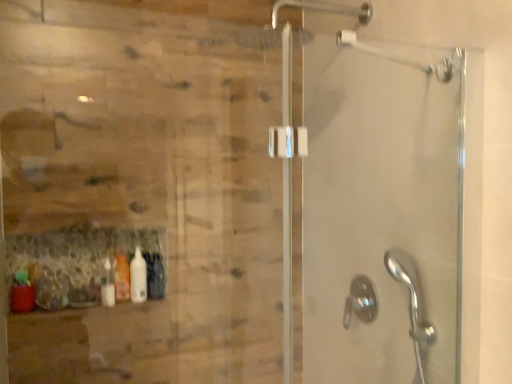
Where is `satin nickel showerhead at lower right`? satin nickel showerhead at lower right is located at coordinates (360, 301).

What do you see at coordinates (360, 301) in the screenshot? I see `satin nickel showerhead at lower right` at bounding box center [360, 301].

This screenshot has height=384, width=512. What do you see at coordinates (138, 277) in the screenshot?
I see `white glossy bottle at lower left, the 2th bottle positioned from the front` at bounding box center [138, 277].

Where is `translucent plastic bottle at lower left, which appears as the first bottle when viewed from the back`? The width and height of the screenshot is (512, 384). translucent plastic bottle at lower left, which appears as the first bottle when viewed from the back is located at coordinates (122, 278).

Looking at this image, between translucent plastic bottle at lower left, the third bottle in the front-to-back sequence, and satin nickel showerhead at lower right, which one has larger size?

With larger size is satin nickel showerhead at lower right.

Which object is wider, translucent plastic bottle at lower left, the third bottle in the front-to-back sequence, or satin nickel showerhead at lower right?

satin nickel showerhead at lower right.

From a real-world perspective, which is physically above, translucent plastic bottle at lower left, the third bottle in the front-to-back sequence, or satin nickel showerhead at lower right?

translucent plastic bottle at lower left, the third bottle in the front-to-back sequence.

Is satin nickel showerhead at lower right not near white glossy bottle at lower left, the 2th bottle positioned from the front?

No.

Is satin nickel showerhead at lower right positioned behind white glossy bottle at lower left, the 2th bottle positioned from the front?

No, it is in front of white glossy bottle at lower left, the 2th bottle positioned from the front.

Where is `the 1st bottle counting from the left side of the satin nickel showerhead at lower right`? the 1st bottle counting from the left side of the satin nickel showerhead at lower right is located at coordinates (138, 277).

From a real-world perspective, does satin nickel showerhead at lower right sit lower than white glossy bottle at lower left, the 2th bottle positioned from the front?

Yes, from a real-world perspective, satin nickel showerhead at lower right is under white glossy bottle at lower left, the 2th bottle positioned from the front.

Is white glossy bottle at lower left, the 2th bottle positioned from the front, oriented away from translucent plastic bottle at lower left, the third bottle in the front-to-back sequence?

No, white glossy bottle at lower left, the 2th bottle positioned from the front, is not facing the opposite direction of translucent plastic bottle at lower left, the third bottle in the front-to-back sequence.

Is the position of white glossy bottle at lower left, the 2th bottle positioned from the front, less distant than that of translucent plastic bottle at lower left, which ranks as the 2th bottle in right-to-left order?

That is True.

Considering the relative sizes of white glossy bottle at lower left, the second bottle positioned from the back, and translucent plastic bottle at lower left, the second bottle when ordered from left to right, in the image provided, is white glossy bottle at lower left, the second bottle positioned from the back, thinner than translucent plastic bottle at lower left, the second bottle when ordered from left to right,?

Incorrect, the width of white glossy bottle at lower left, the second bottle positioned from the back, is not less than that of translucent plastic bottle at lower left, the second bottle when ordered from left to right.

Starting from the translucent plastic bottle at lower left, which appears as the first bottle when viewed from the back, which bottle is the 1st one in front? Please provide its 2D coordinates.

[(138, 277)]

Is matte red bottle at lower left, the third bottle viewed from the right, further to camera compared to satin nickel showerhead at lower right?

Yes, matte red bottle at lower left, the third bottle viewed from the right, is behind satin nickel showerhead at lower right.

In the scene shown: Is satin nickel showerhead at lower right at the back of matte red bottle at lower left, the first bottle in the left-to-right sequence?

That's not correct — matte red bottle at lower left, the first bottle in the left-to-right sequence, is not looking away from satin nickel showerhead at lower right.

Locate an element on the screen. This screenshot has height=384, width=512. bottle that is the 1st object above the satin nickel showerhead at lower right (from a real-world perspective) is located at coordinates (22, 293).

From the image's perspective, is matte red bottle at lower left, the first bottle in the left-to-right sequence, above or below satin nickel showerhead at lower right?

matte red bottle at lower left, the first bottle in the left-to-right sequence, is above satin nickel showerhead at lower right.

From the picture: Does satin nickel showerhead at lower right have a larger size compared to translucent plastic bottle at lower left, the second bottle when ordered from left to right?

Correct, satin nickel showerhead at lower right is larger in size than translucent plastic bottle at lower left, the second bottle when ordered from left to right.

Is satin nickel showerhead at lower right not close to translucent plastic bottle at lower left, which ranks as the 2th bottle in right-to-left order?

No, satin nickel showerhead at lower right is not far from translucent plastic bottle at lower left, which ranks as the 2th bottle in right-to-left order.

Is translucent plastic bottle at lower left, the third bottle in the front-to-back sequence, at the back of satin nickel showerhead at lower right?

No, satin nickel showerhead at lower right's orientation is not away from translucent plastic bottle at lower left, the third bottle in the front-to-back sequence.

Between satin nickel showerhead at lower right and translucent plastic bottle at lower left, the third bottle in the front-to-back sequence, which one has less height?

Standing shorter between the two is satin nickel showerhead at lower right.

You are a GUI agent. You are given a task and a screenshot of the screen. Output one action in this format:
    pyautogui.click(x=<x>, y=<y>)
    Task: Click on the bottle above the translucent plastic bottle at lower left, which ranks as the 2th bottle in right-to-left order (from a real-world perspective)
    The image size is (512, 384).
    Given the screenshot: What is the action you would take?
    pyautogui.click(x=138, y=277)

From their relative heights in the image, would you say translucent plastic bottle at lower left, which ranks as the 2th bottle in right-to-left order, is taller or shorter than white glossy bottle at lower left, the 2th bottle positioned from the front?

In the image, translucent plastic bottle at lower left, which ranks as the 2th bottle in right-to-left order, appears to be shorter than white glossy bottle at lower left, the 2th bottle positioned from the front.

Is translucent plastic bottle at lower left, which ranks as the 2th bottle in right-to-left order, bigger than white glossy bottle at lower left, the 2th bottle positioned from the front?

Incorrect, translucent plastic bottle at lower left, which ranks as the 2th bottle in right-to-left order, is not larger than white glossy bottle at lower left, the 2th bottle positioned from the front.

From a real-world perspective, which object stands above the other?

In real-world perspective, translucent plastic bottle at lower left, which ranks as the 2th bottle in right-to-left order, is above.

Considering the sizes of objects matte red bottle at lower left, the first bottle in the left-to-right sequence, and translucent plastic bottle at lower left, the third bottle in the front-to-back sequence, in the image provided, who is shorter, matte red bottle at lower left, the first bottle in the left-to-right sequence, or translucent plastic bottle at lower left, the third bottle in the front-to-back sequence,?

matte red bottle at lower left, the first bottle in the left-to-right sequence, is shorter.

Is the depth of matte red bottle at lower left, acting as the 3th bottle starting from the back, less than that of translucent plastic bottle at lower left, the second bottle when ordered from left to right?

Yes, matte red bottle at lower left, acting as the 3th bottle starting from the back, is in front of translucent plastic bottle at lower left, the second bottle when ordered from left to right.

Which object is wider, matte red bottle at lower left, the first bottle from the front, or translucent plastic bottle at lower left, the second bottle when ordered from left to right?

With larger width is matte red bottle at lower left, the first bottle from the front.

Which bottle is the 2nd one when counting from the left side of the satin nickel showerhead at lower right? Please provide its 2D coordinates.

[(122, 278)]

Find the location of a particular element. the 3rd bottle above when counting from the satin nickel showerhead at lower right (from the image's perspective) is located at coordinates (138, 277).

From the image, which object appears to be farther from matte red bottle at lower left, the third bottle viewed from the right, white glossy bottle at lower left, the 2th bottle positioned from the front, or satin nickel showerhead at lower right?

satin nickel showerhead at lower right is further to matte red bottle at lower left, the third bottle viewed from the right.

Based on their spatial positions, is white glossy bottle at lower left, the second bottle positioned from the back, or satin nickel showerhead at lower right closer to translucent plastic bottle at lower left, which appears as the first bottle when viewed from the back?

Based on the image, white glossy bottle at lower left, the second bottle positioned from the back, appears to be nearer to translucent plastic bottle at lower left, which appears as the first bottle when viewed from the back.

Looking at the image, which one is located further to satin nickel showerhead at lower right, translucent plastic bottle at lower left, the second bottle when ordered from left to right, or white glossy bottle at lower left, which is the third bottle from left to right?

translucent plastic bottle at lower left, the second bottle when ordered from left to right, is further to satin nickel showerhead at lower right.

When comparing their distances from white glossy bottle at lower left, which is the third bottle from left to right, does translucent plastic bottle at lower left, which appears as the first bottle when viewed from the back, or matte red bottle at lower left, the first bottle in the left-to-right sequence, seem further?

matte red bottle at lower left, the first bottle in the left-to-right sequence, lies further to white glossy bottle at lower left, which is the third bottle from left to right, than the other object.

Estimate the real-world distances between objects in this image. Which object is further from matte red bottle at lower left, the third bottle viewed from the right, translucent plastic bottle at lower left, which ranks as the 2th bottle in right-to-left order, or white glossy bottle at lower left, the second bottle positioned from the back?

white glossy bottle at lower left, the second bottle positioned from the back, is further to matte red bottle at lower left, the third bottle viewed from the right.

Which object lies further to the anchor point translucent plastic bottle at lower left, the third bottle in the front-to-back sequence, white glossy bottle at lower left, the 2th bottle positioned from the front, or matte red bottle at lower left, acting as the 3th bottle starting from the back?

matte red bottle at lower left, acting as the 3th bottle starting from the back.

When comparing their distances from white glossy bottle at lower left, which is the third bottle from left to right, does satin nickel showerhead at lower right or matte red bottle at lower left, the first bottle in the left-to-right sequence, seem further?

Among the two, matte red bottle at lower left, the first bottle in the left-to-right sequence, is located further to white glossy bottle at lower left, which is the third bottle from left to right.

Which object lies further to the anchor point white glossy bottle at lower left, the second bottle positioned from the back, translucent plastic bottle at lower left, which ranks as the 2th bottle in right-to-left order, or satin nickel showerhead at lower right?

satin nickel showerhead at lower right is further to white glossy bottle at lower left, the second bottle positioned from the back.

Find the location of a particular element. This screenshot has width=512, height=384. bottle situated between matte red bottle at lower left, acting as the 3th bottle starting from the back, and white glossy bottle at lower left, the 2th bottle positioned from the front, from left to right is located at coordinates (x=122, y=278).

Where is `bottle located between translucent plastic bottle at lower left, which ranks as the 2th bottle in right-to-left order, and satin nickel showerhead at lower right in the left-right direction`? The width and height of the screenshot is (512, 384). bottle located between translucent plastic bottle at lower left, which ranks as the 2th bottle in right-to-left order, and satin nickel showerhead at lower right in the left-right direction is located at coordinates (138, 277).